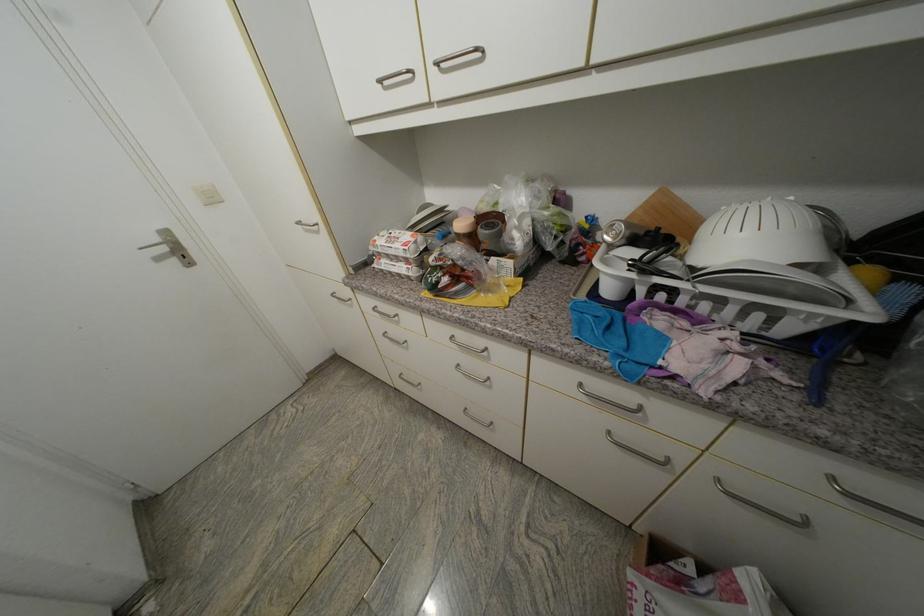
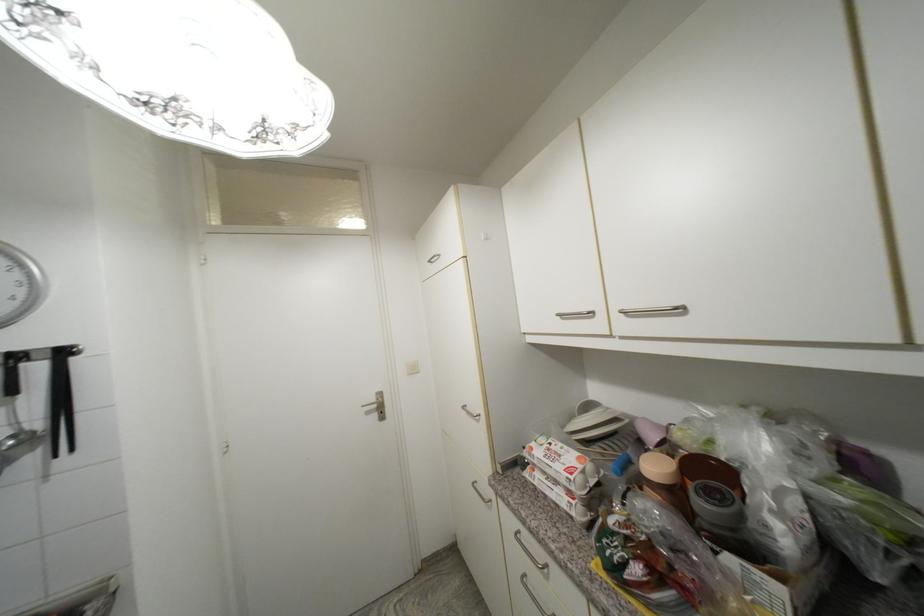
The point at (493, 228) is marked in the first image. Where is the corresponding point in the second image?

(714, 496)